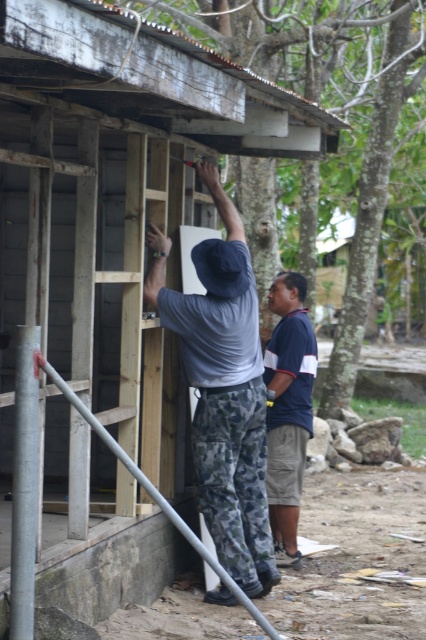
Is camouflage pants at center above blue striped shirt at center?

Correct, camouflage pants at center is located above blue striped shirt at center.

Which is in front, point (264, 451) or point (296, 500)?

Point (264, 451) is in front.

Measure the distance between camouflage pants at center and camera.

camouflage pants at center and camera are 24.94 feet apart from each other.

At what (x,y) coordinates should I click in order to perform the action: click on camouflage pants at center. Please return your answer as a coordinate pair (x, y). This screenshot has height=640, width=426. Looking at the image, I should click on (222, 390).

Does brown wood tree at upper center appear under blue striped shirt at center?

Actually, brown wood tree at upper center is above blue striped shirt at center.

Can you confirm if brown wood tree at upper center is positioned to the right of blue striped shirt at center?

Correct, you'll find brown wood tree at upper center to the right of blue striped shirt at center.

The height and width of the screenshot is (640, 426). Find the location of `brown wood tree at upper center`. brown wood tree at upper center is located at coordinates coord(192,90).

Identify the location of brown wood tree at upper center. The image size is (426, 640). (192, 90).

Is brown wood tree at upper center positioned at the back of camouflage pants at center?

Yes, it is.

Does brown wood tree at upper center appear on the right side of camouflage pants at center?

Indeed, brown wood tree at upper center is positioned on the right side of camouflage pants at center.

Between point (282, 118) and point (216, 532), which one is positioned behind?

Point (282, 118)

Identify the location of brown wood tree at upper center. The width and height of the screenshot is (426, 640). (192, 90).